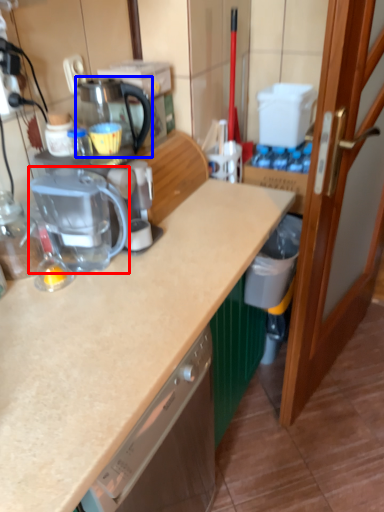
Question: Which of the following is the farthest to the observer, kitchen appliance (highlighted by a red box) or coffeepot (highlighted by a blue box)?

Choices:
 (A) kitchen appliance
 (B) coffeepot

Answer: (B)